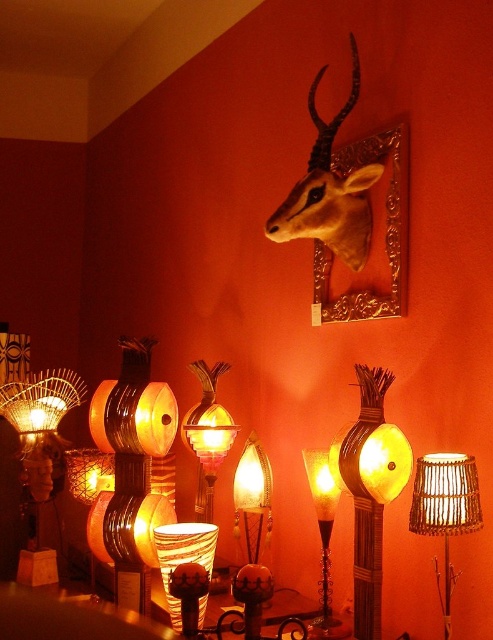
What are the coordinates of the matte wicker lamp at left?

The coordinates of the matte wicker lamp at left are at point (39, 451).

You are standing in front of the wall with decorative lamps and a mounted animal head. You want to place a new lamp at point [357,540]. If your arm reaches 1.5 meters, can you comfortably reach that point?

The distance of point [357,540] from viewer is 1.61 meters, so you cannot comfortably reach it with an arm reach of 1.5 meters.

You are an interior designer planning to place a new shelf between the woven bamboo lamp at center and the matte brown deer head at upper center. The shelf is 24 inches long. Will it fit without overlapping either object?

The distance between the woven bamboo lamp at center and the matte brown deer head at upper center is 25.86 inches. Since the shelf is 24 inches long, it will fit between them without overlapping either object.